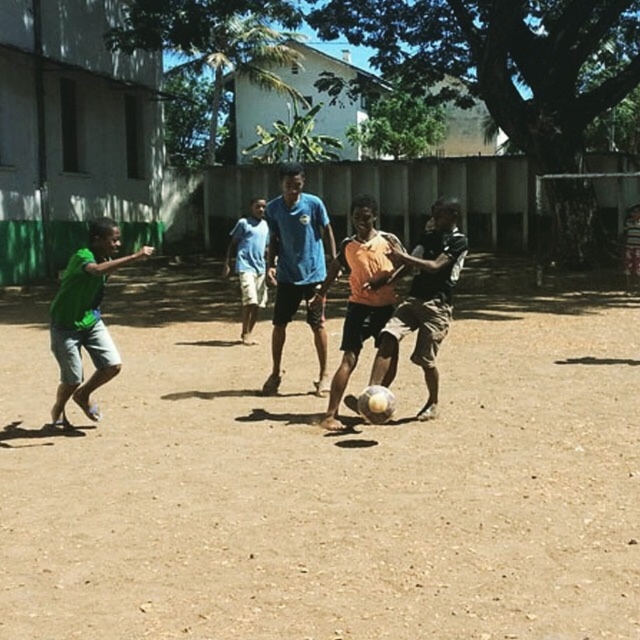
You are a referee in a soccer match and need to ensure players are not too close to the ball. The minimum distance required between two players is 5 meters. Are the blue fabric shirt at center and blue cotton shirt at center maintaining the required distance?

The distance between the blue fabric shirt at center and blue cotton shirt at center is 5.45 meters, which is greater than the required 5 meters. Therefore, they are maintaining the required distance.

You are a photographer trying to capture a photo of the blue fabric shirt at center and the brown sandy soil at center. Which object is positioned lower in the image?

The brown sandy soil at center is located below the blue fabric shirt at center, so it is positioned lower in the image.